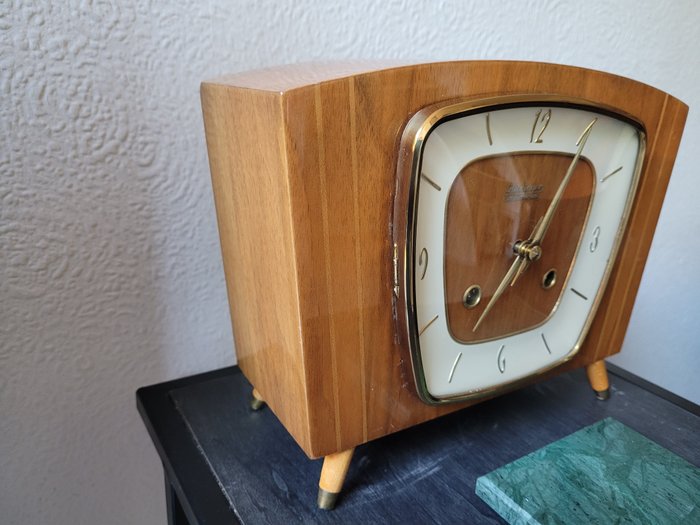
Find the location of a particular element. metal leg tips is located at coordinates (320, 495), (605, 391), (257, 405).